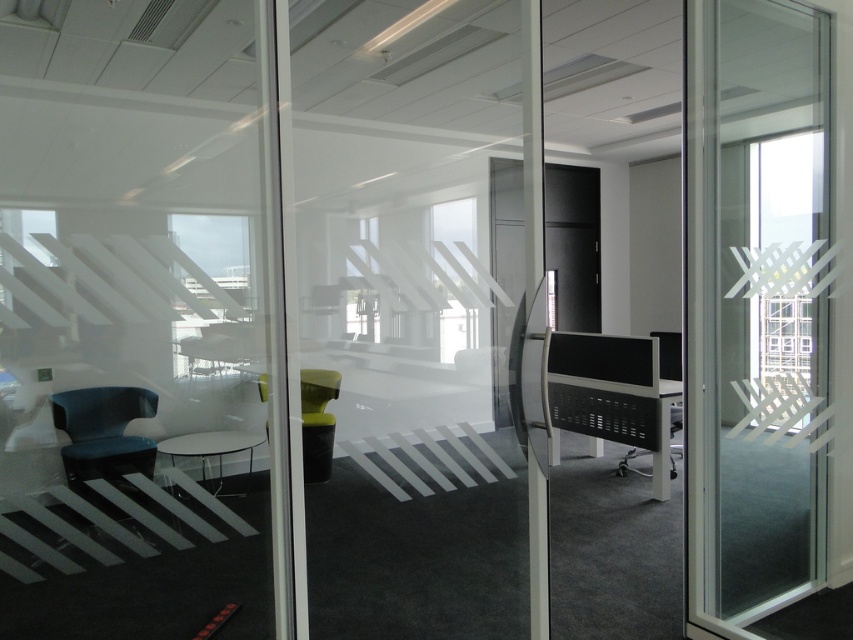
You are a delivery person trying to enter the office through the transparent glass screen door at right. There is a matte black chair at right blocking the entrance. Can you squeeze through the space between the door and the chair?

The transparent glass screen door at right might be wider than matte black chair at right, so there might be enough space to squeeze through the entrance.